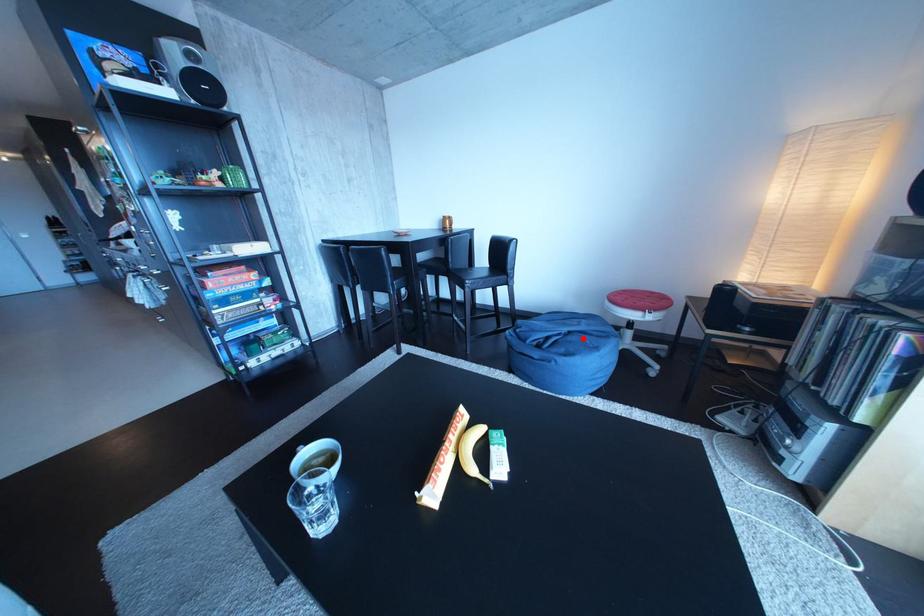
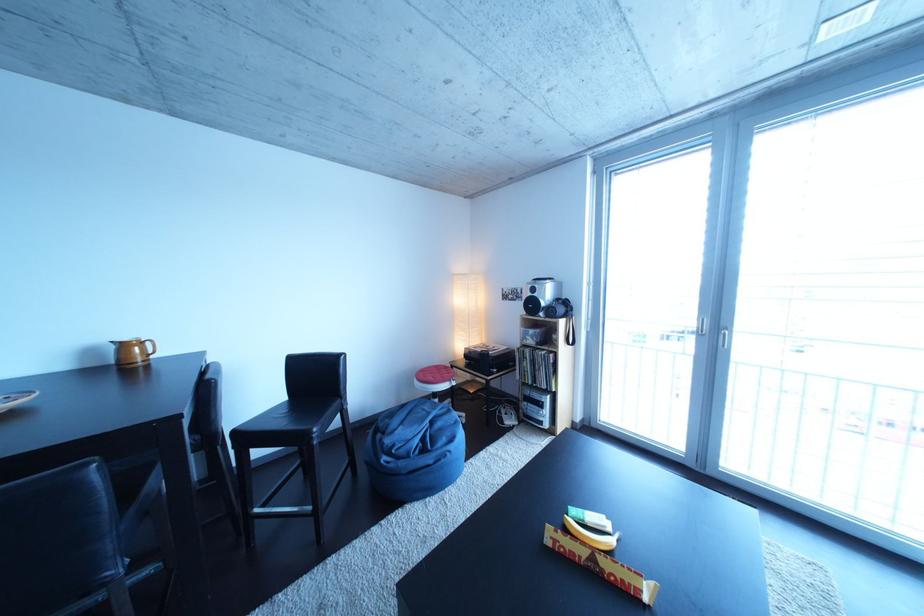
Find the pixel in the second image that matches the highlighted location in the first image.

(444, 428)